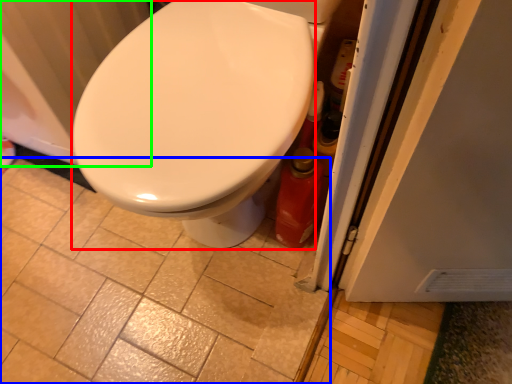
Question: Considering the real-world distances, which object is farthest from bidet (highlighted by a red box)? ceramic tile (highlighted by a blue box) or radiator (highlighted by a green box)?

Choices:
 (A) ceramic tile
 (B) radiator

Answer: (A)